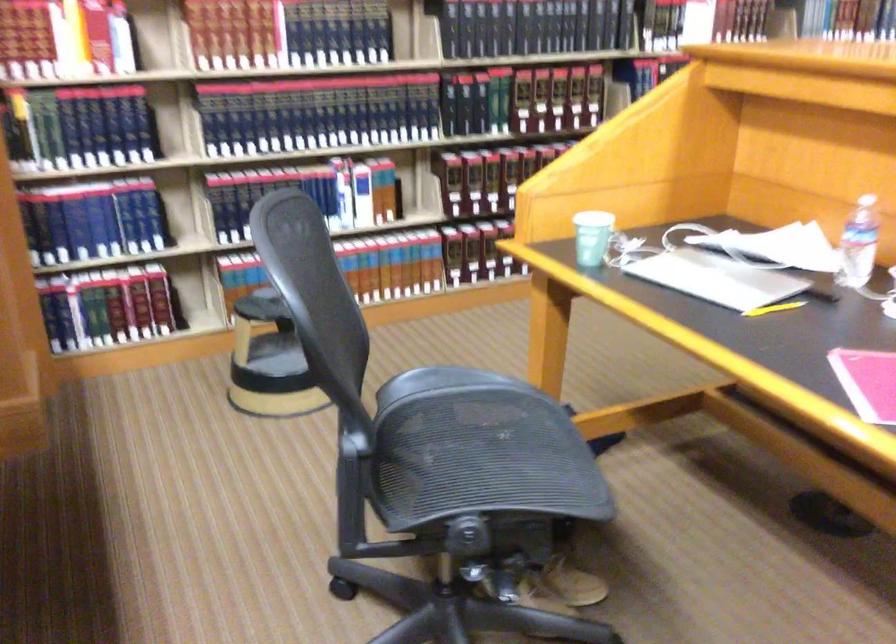
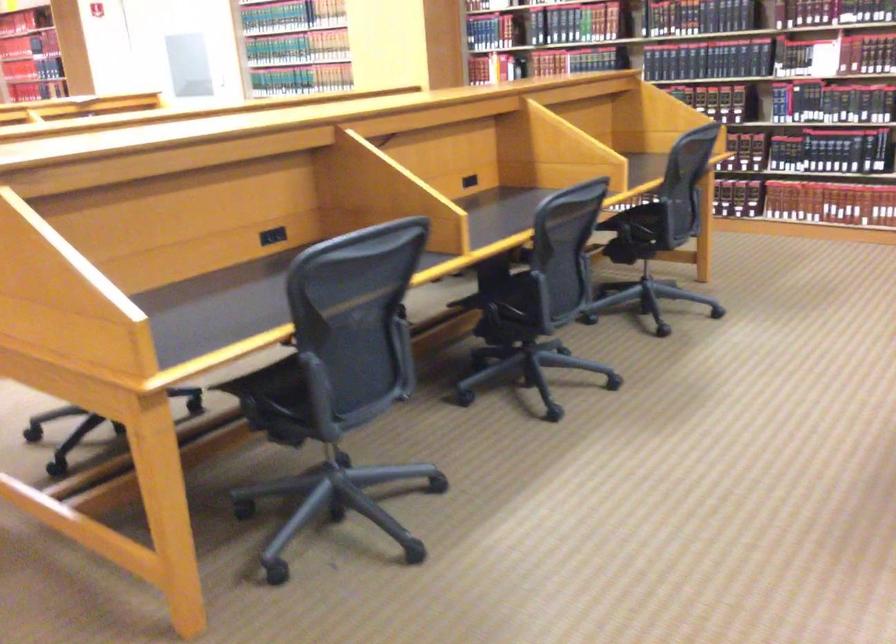
Question: I am providing you with two images of the same scene from different viewpoints. After the viewpoint changes to image2, which objects are now occluded?

Choices:
 (A) white plastic lid
 (B) chair armrest
 (C) black power outlet
 (D) chair sitting surface

Answer: (D)